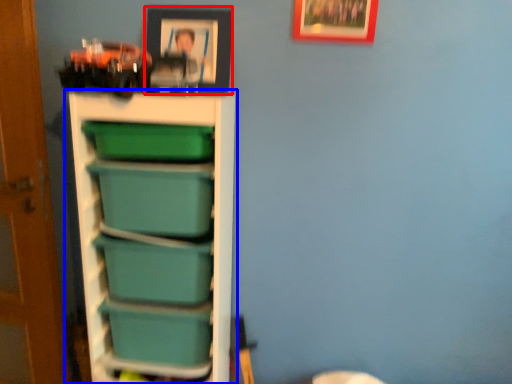
Question: Which object is further to the camera taking this photo, picture frame (highlighted by a red box) or shelf (highlighted by a blue box)?

Choices:
 (A) picture frame
 (B) shelf

Answer: (A)